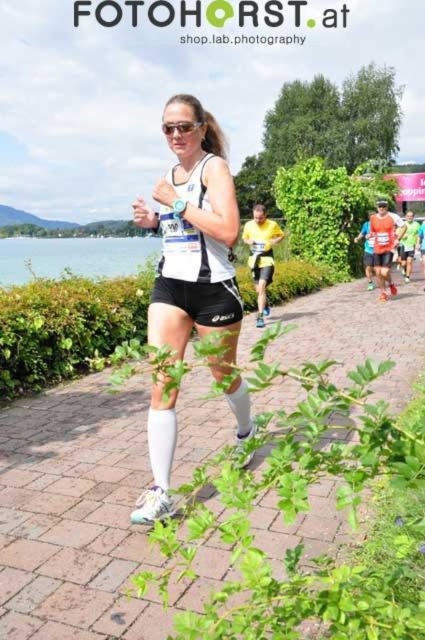
Question: Among these objects, which one is nearest to the camera?

Choices:
 (A) yellow fabric shirt at center
 (B) white fabric shorts at center
 (C) white matte running shorts at center

Answer: (C)

Question: Which point is closer to the camera?

Choices:
 (A) yellow fabric shirt at center
 (B) white matte running shorts at center
 (C) white fabric shorts at center

Answer: (B)

Question: Does white fabric shorts at center have a greater width compared to white matte running shorts at center?

Choices:
 (A) yes
 (B) no

Answer: (A)

Question: Which point is farther from the camera taking this photo?

Choices:
 (A) (176, 241)
 (B) (337, 292)
 (C) (263, 292)

Answer: (B)

Question: Is the position of white matte running shorts at center less distant than that of yellow fabric shirt at center?

Choices:
 (A) no
 (B) yes

Answer: (B)

Question: Is white fabric shorts at center above white matte running shorts at center?

Choices:
 (A) yes
 (B) no

Answer: (B)